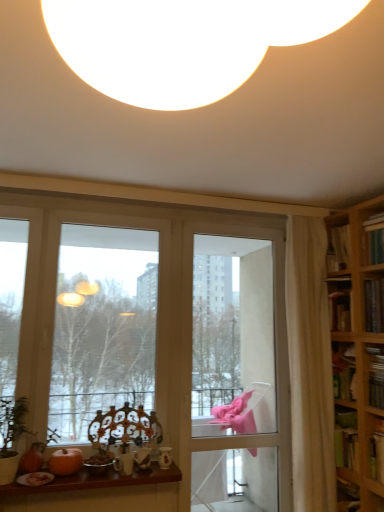
Question: Should I look upward or downward to see hardcover book at right, marked as the third book in a top-to-bottom arrangement?

Choices:
 (A) up
 (B) down

Answer: (B)

Question: From the image's perspective, is clear glass screen door at center located beneath transparent glass window at center?

Choices:
 (A) yes
 (B) no

Answer: (A)

Question: Is clear glass screen door at center oriented away from transparent glass window at center?

Choices:
 (A) yes
 (B) no

Answer: (B)

Question: Considering the relative positions of clear glass screen door at center and transparent glass window at center in the image provided, is clear glass screen door at center to the left of transparent glass window at center from the viewer's perspective?

Choices:
 (A) yes
 (B) no

Answer: (B)

Question: Can you confirm if clear glass screen door at center is taller than transparent glass window at center?

Choices:
 (A) no
 (B) yes

Answer: (B)

Question: Is there a large distance between clear glass screen door at center and transparent glass window at center?

Choices:
 (A) yes
 (B) no

Answer: (A)

Question: Considering the relative positions of clear glass screen door at center and transparent glass window at center in the image provided, is clear glass screen door at center to the right of transparent glass window at center from the viewer's perspective?

Choices:
 (A) no
 (B) yes

Answer: (B)

Question: Does orange matte pumpkin at lower left appear on the left side of white sheer curtain at right?

Choices:
 (A) yes
 (B) no

Answer: (A)

Question: Can you confirm if orange matte pumpkin at lower left is thinner than white sheer curtain at right?

Choices:
 (A) yes
 (B) no

Answer: (A)

Question: Considering the relative positions of orange matte pumpkin at lower left and white sheer curtain at right in the image provided, is orange matte pumpkin at lower left to the right of white sheer curtain at right from the viewer's perspective?

Choices:
 (A) yes
 (B) no

Answer: (B)

Question: Is orange matte pumpkin at lower left bigger than white sheer curtain at right?

Choices:
 (A) no
 (B) yes

Answer: (A)

Question: Is the depth of orange matte pumpkin at lower left less than that of white sheer curtain at right?

Choices:
 (A) no
 (B) yes

Answer: (B)

Question: Does orange matte pumpkin at lower left have a lesser height compared to white sheer curtain at right?

Choices:
 (A) no
 (B) yes

Answer: (B)

Question: From a real-world perspective, is hardcover book at upper right, the first book in the top-to-bottom sequence, below transparent glass window at center?

Choices:
 (A) no
 (B) yes

Answer: (A)